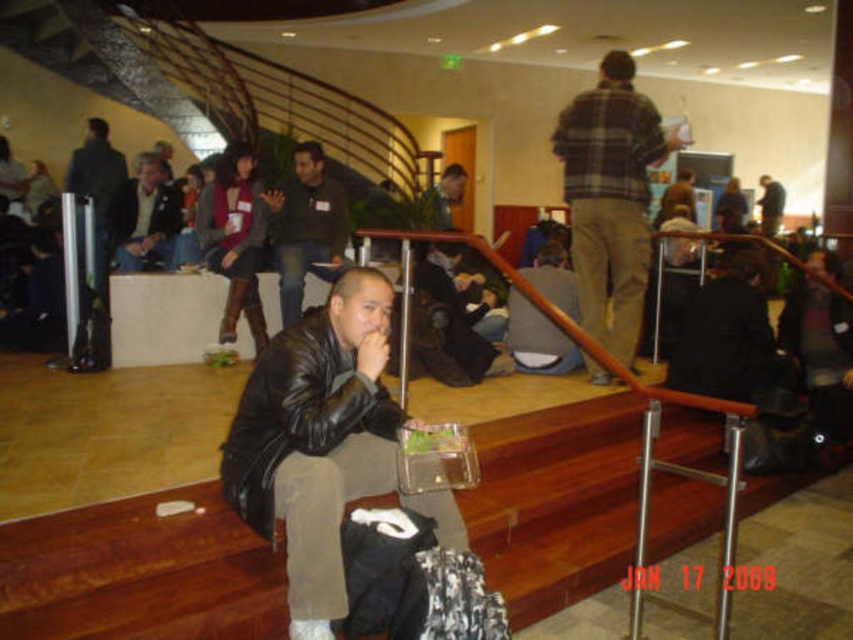
Between point (605, 152) and point (285, 209), which one is positioned in front?

Point (605, 152) is more forward.

Where is `plaid flannel shirt at upper right`? The height and width of the screenshot is (640, 853). plaid flannel shirt at upper right is located at coordinates (608, 198).

The image size is (853, 640). I want to click on plaid flannel shirt at upper right, so click(x=608, y=198).

What do you see at coordinates (608, 198) in the screenshot? This screenshot has width=853, height=640. I see `plaid flannel shirt at upper right` at bounding box center [608, 198].

Can you confirm if plaid flannel shirt at upper right is shorter than matte black leather jacket at center?

No, plaid flannel shirt at upper right is not shorter than matte black leather jacket at center.

Between point (601, 177) and point (258, 477), which one is positioned behind?

Positioned behind is point (601, 177).

The width and height of the screenshot is (853, 640). What are the coordinates of `plaid flannel shirt at upper right` in the screenshot? It's located at (608, 198).

Describe the element at coordinates (537, 339) in the screenshot. I see `dark gray leather jacket at center` at that location.

Is point (546, 253) more distant than point (155, 225)?

No, it is in front of (155, 225).

Is point (529, 356) in front of point (161, 184)?

Yes, point (529, 356) is in front of point (161, 184).

Identify the location of dark gray leather jacket at center. (537, 339).